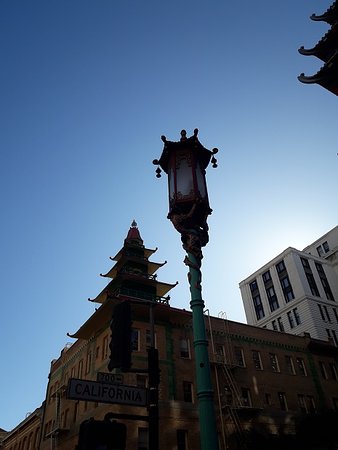
At what (x,y) coordinates should I click in order to perform the action: click on bottom right corner empty space. Please return your answer as a coordinate pair (x, y). The height and width of the screenshot is (450, 338). Looking at the image, I should click on (335, 446).